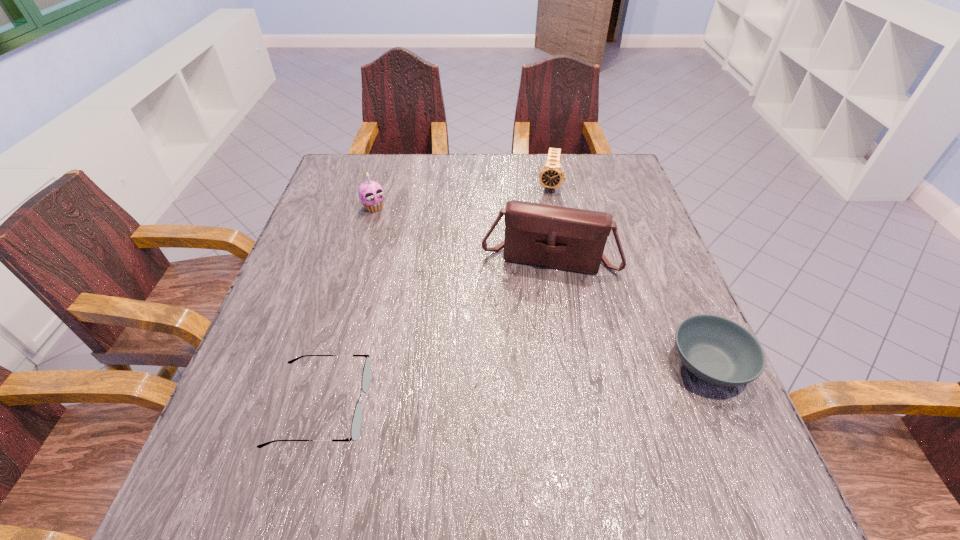
In the image, there is a desktop. Where is `vacant space at the far right corner`? This screenshot has width=960, height=540. vacant space at the far right corner is located at coordinates (636, 188).

The width and height of the screenshot is (960, 540). In the image, there is a desktop. Find the location of `vacant space at the near right corner`. vacant space at the near right corner is located at coordinates (739, 435).

I want to click on vacant point located between the soup bowl and the cupcake, so click(541, 286).

The width and height of the screenshot is (960, 540). Find the location of `unoccupied position between the cupcake and the farthest object`. unoccupied position between the cupcake and the farthest object is located at coordinates (461, 197).

I want to click on vacant area between the fourth nearest object and the spectacles, so click(348, 307).

You are a GUI agent. You are given a task and a screenshot of the screen. Output one action in this format:
    pyautogui.click(x=<x>, y=<y>)
    Task: Click on the unoccupied position between the soup bowl and the cupcake
    The height and width of the screenshot is (540, 960).
    Given the screenshot: What is the action you would take?
    pyautogui.click(x=541, y=286)

What are the coordinates of `free space between the rightmost object and the tallest object` in the screenshot? It's located at click(x=629, y=312).

The image size is (960, 540). What are the coordinates of `vacant space in between the rightmost object and the spectacles` in the screenshot? It's located at (516, 385).

Image resolution: width=960 pixels, height=540 pixels. I want to click on free space between the third farthest object and the cupcake, so click(x=462, y=233).

You are a GUI agent. You are given a task and a screenshot of the screen. Output one action in this format:
    pyautogui.click(x=<x>, y=<y>)
    Task: Click on the free spot between the farthest object and the rightmost object
    
    Given the screenshot: What is the action you would take?
    pyautogui.click(x=629, y=275)